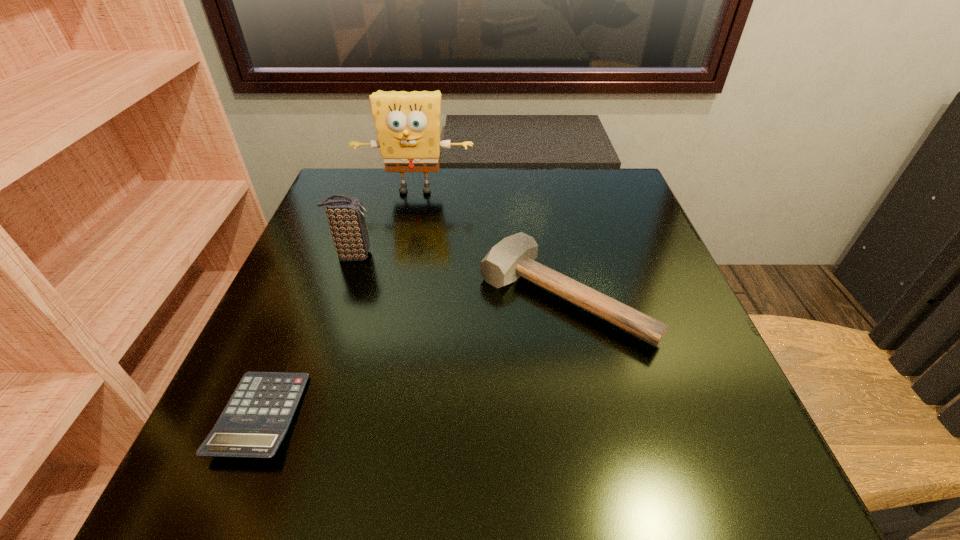
What are the coordinates of `vacant space that satisfies the following two spatial constraints: 1. on the face of the mallet; 2. on the right side of the sponge` in the screenshot? It's located at (394, 296).

This screenshot has width=960, height=540. Find the location of `free space that satisfies the following two spatial constraints: 1. on the face of the farthest object; 2. with the zip open on the clutch bag`. free space that satisfies the following two spatial constraints: 1. on the face of the farthest object; 2. with the zip open on the clutch bag is located at coordinates (402, 255).

Where is `free spot that satisfies the following two spatial constraints: 1. on the face of the sponge; 2. on the right side of the mallet`? This screenshot has height=540, width=960. free spot that satisfies the following two spatial constraints: 1. on the face of the sponge; 2. on the right side of the mallet is located at coordinates (394, 296).

Locate an element on the screen. free space in the image that satisfies the following two spatial constraints: 1. with the zip open on the third shortest object; 2. on the left side of the rightmost object is located at coordinates (339, 296).

You are a GUI agent. You are given a task and a screenshot of the screen. Output one action in this format:
    pyautogui.click(x=<x>, y=<y>)
    Task: Click on the free space that satisfies the following two spatial constraints: 1. on the face of the farthest object; 2. with the zip open on the clutch bag
    
    Given the screenshot: What is the action you would take?
    pyautogui.click(x=402, y=255)

Identify the location of vacant space that satisfies the following two spatial constraints: 1. on the face of the farthest object; 2. with the zip open on the clutch bag. The image size is (960, 540). (402, 255).

Where is `free spot that satisfies the following two spatial constraints: 1. on the face of the rightmost object; 2. on the right side of the farthest object`? The image size is (960, 540). free spot that satisfies the following two spatial constraints: 1. on the face of the rightmost object; 2. on the right side of the farthest object is located at coordinates (394, 296).

You are a GUI agent. You are given a task and a screenshot of the screen. Output one action in this format:
    pyautogui.click(x=<x>, y=<y>)
    Task: Click on the free point that satisfies the following two spatial constraints: 1. with the zip open on the third shortest object; 2. on the front side of the nearest object
    
    Given the screenshot: What is the action you would take?
    pyautogui.click(x=299, y=416)